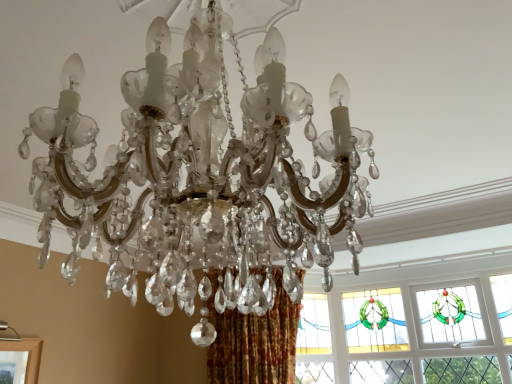
Question: Does stained glass window at upper right appear on the left side of clear crystal chandelier at center?

Choices:
 (A) no
 (B) yes

Answer: (A)

Question: Does stained glass window at upper right have a smaller size compared to clear crystal chandelier at center?

Choices:
 (A) yes
 (B) no

Answer: (A)

Question: Is stained glass window at upper right to the right of clear crystal chandelier at center from the viewer's perspective?

Choices:
 (A) no
 (B) yes

Answer: (B)

Question: Would you consider stained glass window at upper right to be distant from clear crystal chandelier at center?

Choices:
 (A) yes
 (B) no

Answer: (A)

Question: From a real-world perspective, is stained glass window at upper right over clear crystal chandelier at center?

Choices:
 (A) no
 (B) yes

Answer: (A)

Question: Are stained glass window at upper right and clear crystal chandelier at center making contact?

Choices:
 (A) yes
 (B) no

Answer: (B)

Question: Is clear crystal chandelier at center far away from stained glass window at upper right?

Choices:
 (A) yes
 (B) no

Answer: (A)

Question: Does clear crystal chandelier at center come in front of stained glass window at upper right?

Choices:
 (A) no
 (B) yes

Answer: (B)

Question: Is clear crystal chandelier at center taller than stained glass window at upper right?

Choices:
 (A) yes
 (B) no

Answer: (B)

Question: Is clear crystal chandelier at center outside stained glass window at upper right?

Choices:
 (A) yes
 (B) no

Answer: (A)

Question: Is stained glass window at upper right completely or partially inside clear crystal chandelier at center?

Choices:
 (A) yes
 (B) no

Answer: (B)

Question: From a real-world perspective, is clear crystal chandelier at center physically above stained glass window at upper right?

Choices:
 (A) yes
 (B) no

Answer: (A)

Question: In terms of height, does clear crystal chandelier at center look taller or shorter compared to stained glass window at upper right?

Choices:
 (A) short
 (B) tall

Answer: (A)